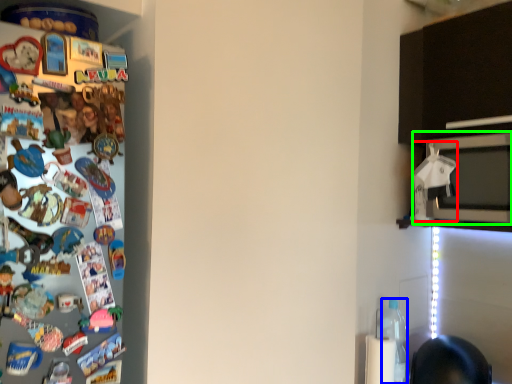
Question: Which object is the closest to the toy (highlighted by a red box)? Choose among these: bottle (highlighted by a blue box) or microwave oven (highlighted by a green box).

Choices:
 (A) bottle
 (B) microwave oven

Answer: (B)